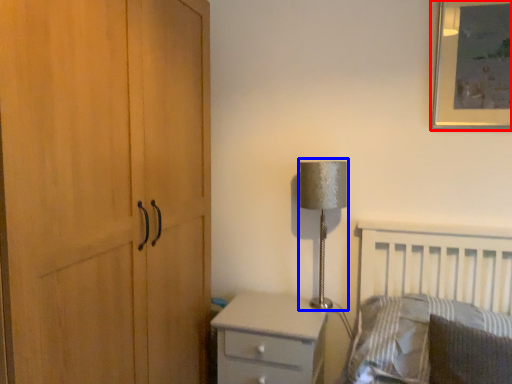
Question: Which object is closer to the camera taking this photo, picture frame (highlighted by a red box) or table lamp (highlighted by a blue box)?

Choices:
 (A) picture frame
 (B) table lamp

Answer: (A)